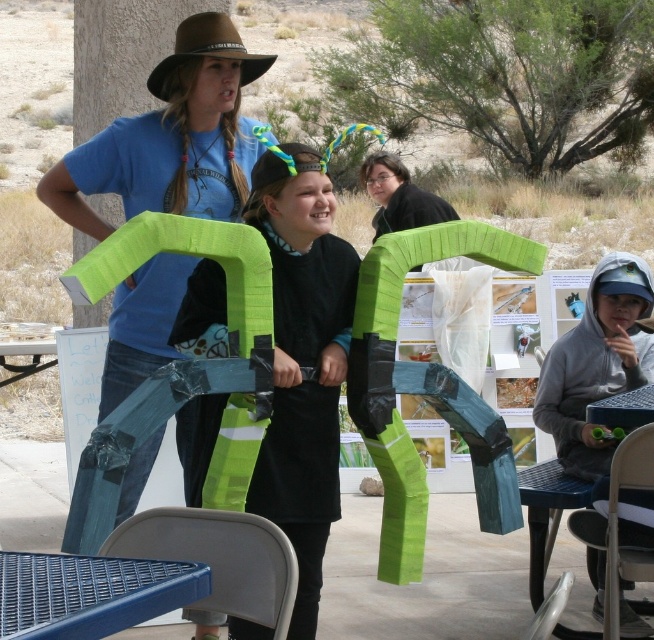
Does black felt dress at center have a greater width compared to blue plastic table at lower left?

Correct, the width of black felt dress at center exceeds that of blue plastic table at lower left.

At what (x,y) coordinates should I click in order to perform the action: click on black felt dress at center. Please return your answer as a coordinate pair (x, y). This screenshot has width=654, height=640. Looking at the image, I should click on (301, 362).

What do you see at coordinates (301, 362) in the screenshot? This screenshot has height=640, width=654. I see `black felt dress at center` at bounding box center [301, 362].

The width and height of the screenshot is (654, 640). Find the location of `black felt dress at center`. black felt dress at center is located at coordinates (301, 362).

Who is taller, gray hoodie at lower right or blue plastic table at lower left?

gray hoodie at lower right is taller.

Between point (596, 440) and point (114, 618), which one is positioned in front?

Point (114, 618) is more forward.

The height and width of the screenshot is (640, 654). Identify the location of gray hoodie at lower right. (596, 364).

Based on the photo, is black felt dress at center to the left of gray hoodie at lower right from the viewer's perspective?

Yes, black felt dress at center is to the left of gray hoodie at lower right.

Who is more forward, (313, 241) or (581, 456)?

Point (313, 241) is more forward.

Identify the location of black felt dress at center. The height and width of the screenshot is (640, 654). (301, 362).